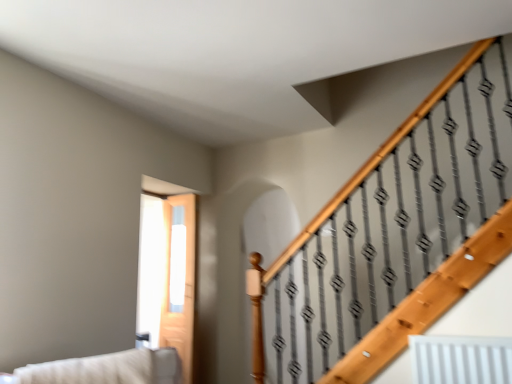
Question: Is beige fabric couch at lower left thinner than clear glass door at center?

Choices:
 (A) no
 (B) yes

Answer: (A)

Question: From the image's perspective, is beige fabric couch at lower left under clear glass door at center?

Choices:
 (A) no
 (B) yes

Answer: (A)

Question: Is beige fabric couch at lower left next to clear glass door at center and touching it?

Choices:
 (A) yes
 (B) no

Answer: (B)

Question: Can you confirm if beige fabric couch at lower left is bigger than clear glass door at center?

Choices:
 (A) no
 (B) yes

Answer: (B)

Question: Is beige fabric couch at lower left oriented towards clear glass door at center?

Choices:
 (A) yes
 (B) no

Answer: (B)

Question: Is beige fabric couch at lower left wider than clear glass door at center?

Choices:
 (A) yes
 (B) no

Answer: (A)

Question: Are clear glass door at center and beige fabric couch at lower left making contact?

Choices:
 (A) yes
 (B) no

Answer: (B)

Question: Could you tell me if clear glass door at center is turned towards beige fabric couch at lower left?

Choices:
 (A) yes
 (B) no

Answer: (B)

Question: Considering the relative positions of clear glass door at center and beige fabric couch at lower left in the image provided, is clear glass door at center behind beige fabric couch at lower left?

Choices:
 (A) no
 (B) yes

Answer: (B)

Question: Can you confirm if clear glass door at center is bigger than beige fabric couch at lower left?

Choices:
 (A) yes
 (B) no

Answer: (B)

Question: From the image's perspective, is clear glass door at center on beige fabric couch at lower left?

Choices:
 (A) no
 (B) yes

Answer: (A)

Question: Does clear glass door at center contain beige fabric couch at lower left?

Choices:
 (A) no
 (B) yes

Answer: (A)

Question: Considering the positions of clear glass door at center and beige fabric couch at lower left in the image, is clear glass door at center wider or thinner than beige fabric couch at lower left?

Choices:
 (A) thin
 (B) wide

Answer: (A)